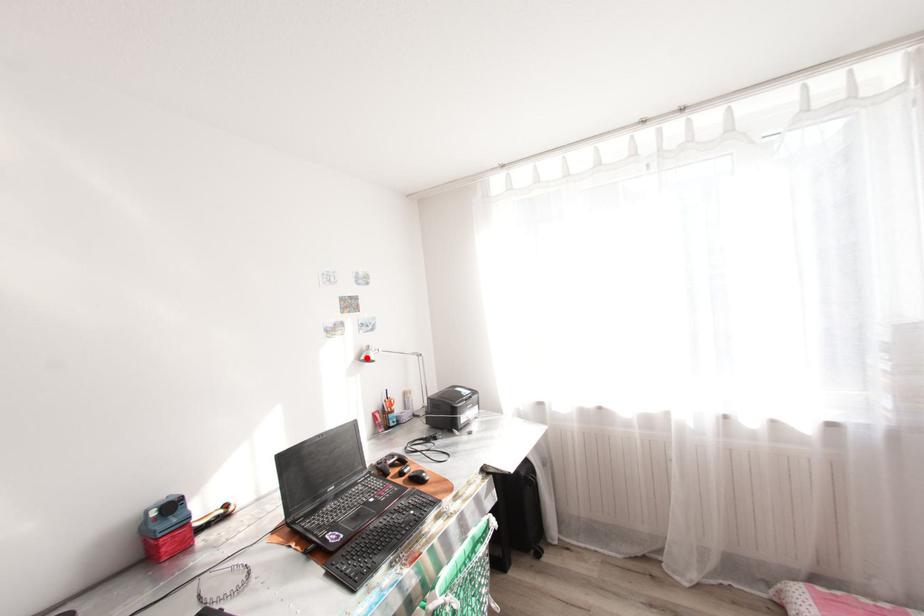
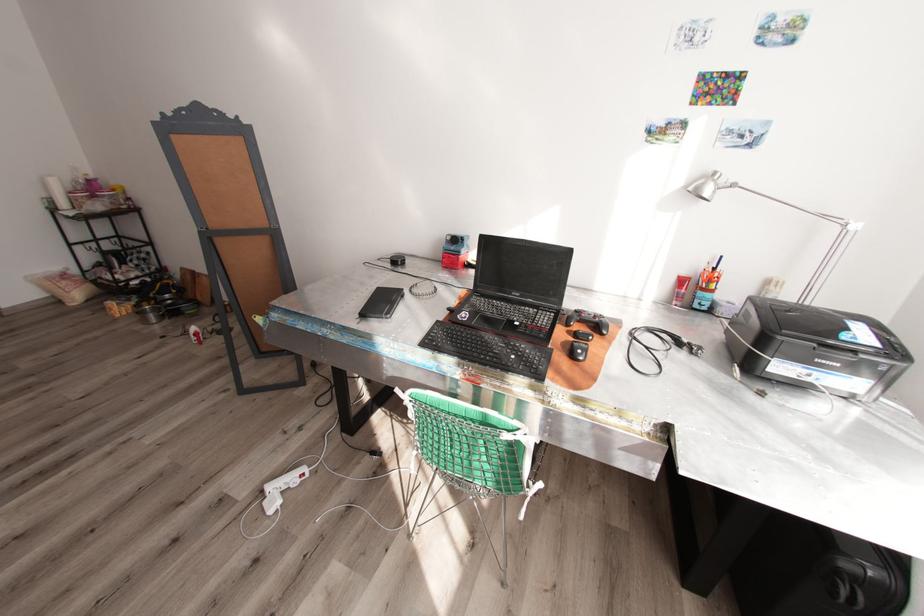
In the second image, find the point that corresponds to the highlighted location in the first image.

(695, 188)